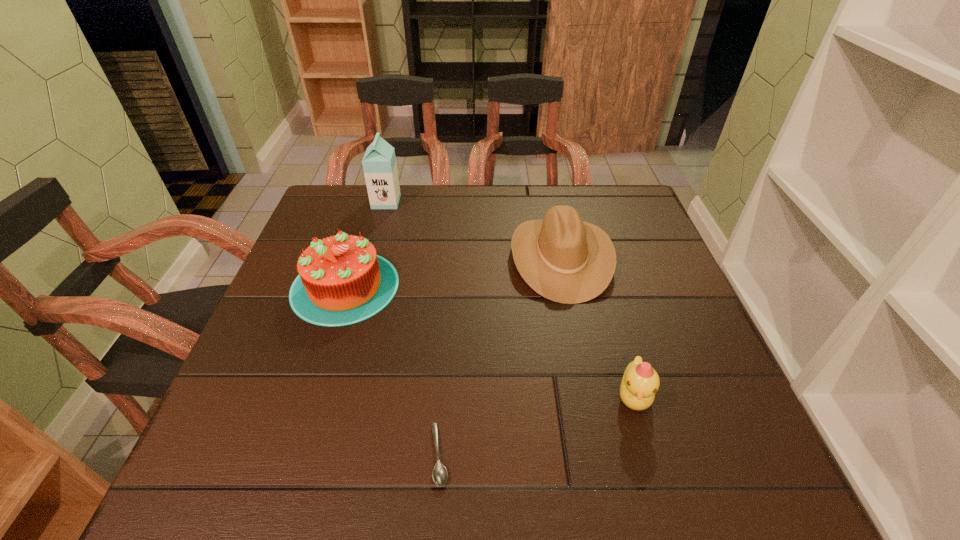
The height and width of the screenshot is (540, 960). I want to click on milk carton, so click(x=379, y=164).

At what (x,y) coordinates should I click in order to perform the action: click on the tallest object. Please return your answer as a coordinate pair (x, y). Looking at the image, I should click on (379, 164).

The height and width of the screenshot is (540, 960). What are the coordinates of `cake` in the screenshot? It's located at (342, 281).

In order to click on cowboy hat in this screenshot , I will do `click(564, 259)`.

Image resolution: width=960 pixels, height=540 pixels. I want to click on duckling, so tap(640, 382).

Where is `soupspoon`? This screenshot has width=960, height=540. soupspoon is located at coordinates (439, 474).

What are the coordinates of `the third object from right to left` in the screenshot? It's located at (439, 474).

Identify the location of vacant space located on the right of the tallest object. (519, 202).

In order to click on vacant space located 0.270m on the back of the cake in this screenshot , I will do 374,195.

This screenshot has width=960, height=540. I want to click on vacant space located 0.240m on the left of the cowboy hat, so click(x=418, y=257).